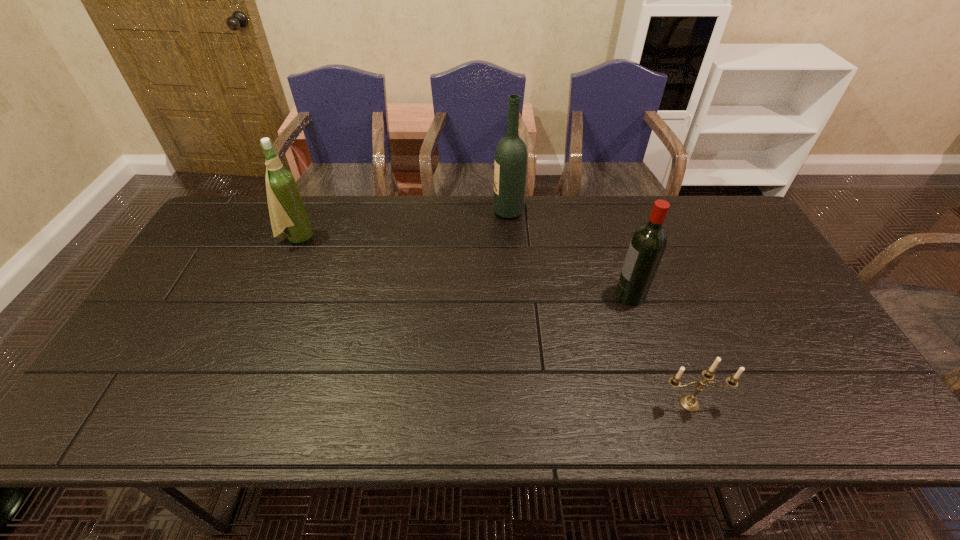
Locate an element on the screen. vacant space that satisfies the following two spatial constraints: 1. on the label of the third farthest object; 2. on the back side of the shortest object is located at coordinates (664, 403).

At what (x,y) coordinates should I click in order to perform the action: click on free region that satisfies the following two spatial constraints: 1. on the labeled side of the nearest object; 2. on the left side of the second wine bottle from right to left. Please return your answer as a coordinate pair (x, y). Looking at the image, I should click on (522, 403).

This screenshot has height=540, width=960. Identify the location of free spot that satisfies the following two spatial constraints: 1. on the label of the nearest wine bottle; 2. on the left side of the candle. (664, 403).

Where is `blank space that satisfies the following two spatial constraints: 1. on the front-facing side of the second nearest wine bottle; 2. on the left side of the shortest object`? blank space that satisfies the following two spatial constraints: 1. on the front-facing side of the second nearest wine bottle; 2. on the left side of the shortest object is located at coordinates (225, 403).